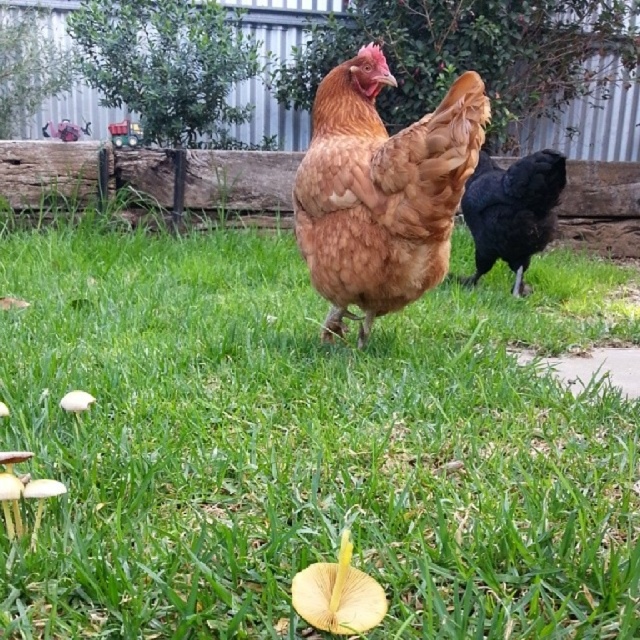
Question: Which point appears farthest from the camera in this image?

Choices:
 (A) (387, 268)
 (B) (566, 344)

Answer: (B)

Question: Does green grass at center appear on the right side of brown feathered chicken at center?

Choices:
 (A) yes
 (B) no

Answer: (A)

Question: Is green grass at center behind shiny black chicken at right?

Choices:
 (A) yes
 (B) no

Answer: (B)

Question: Is brown feathered chicken at center positioned behind shiny black chicken at right?

Choices:
 (A) no
 (B) yes

Answer: (A)

Question: Which point is closer to the camera taking this photo?

Choices:
 (A) (243, 237)
 (B) (448, 148)
 (C) (484, 168)

Answer: (B)

Question: Estimate the real-world distances between objects in this image. Which object is farther from the green grass at center?

Choices:
 (A) shiny black chicken at right
 (B) brown feathered chicken at center

Answer: (A)